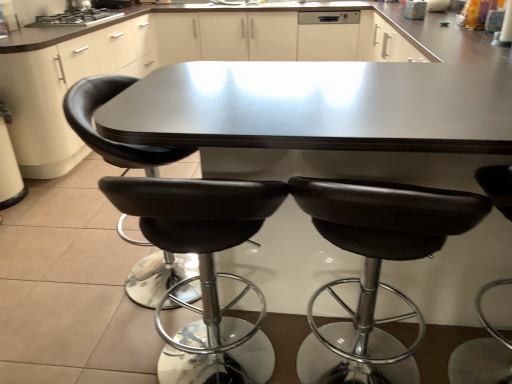
Question: From the image's perspective, is black leather chair at center, acting as the third chair starting from the right, positioned above or below black leather stool at right, arranged as the fourth chair when viewed from the left?

Choices:
 (A) below
 (B) above

Answer: (B)

Question: Relative to black leather stool at right, arranged as the fourth chair when viewed from the left, is black leather chair at center, acting as the third chair starting from the right, in front or behind?

Choices:
 (A) front
 (B) behind

Answer: (B)

Question: Estimate the real-world distances between objects in this image. Which object is closer to the black leather chair at center, acting as the third chair starting from the right?

Choices:
 (A) white matte dishwasher at upper center
 (B) black leather stool at center, arranged as the 2th chair when viewed from the right
 (C) black leather stool at right, arranged as the fourth chair when viewed from the left
 (D) shiny dark wood table at center
 (E) black leather stool at center, which is counted as the first chair, starting from the left

Answer: (B)

Question: Based on their relative distances, which object is farther from the shiny dark wood table at center?

Choices:
 (A) stainless steel stove at upper left
 (B) black leather chair at center, which ranks as the 2th chair in left-to-right order
 (C) black leather stool at center, arranged as the 2th chair when viewed from the right
 (D) black leather stool at center, acting as the fourth chair starting from the right
 (E) black leather stool at right, positioned as the first chair in right-to-left order

Answer: (A)